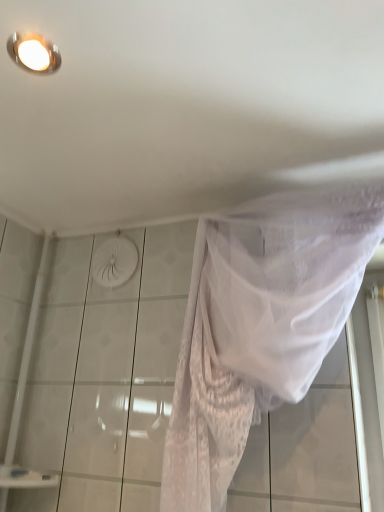
What do you see at coordinates (259, 327) in the screenshot? Image resolution: width=384 pixels, height=512 pixels. I see `translucent white curtain at upper center` at bounding box center [259, 327].

This screenshot has width=384, height=512. In order to click on translucent white curtain at upper center in this screenshot , I will do `click(259, 327)`.

Measure the distance between point (238, 380) and camera.

The depth of point (238, 380) is 38.90 inches.

The height and width of the screenshot is (512, 384). I want to click on translucent white curtain at upper center, so click(x=259, y=327).